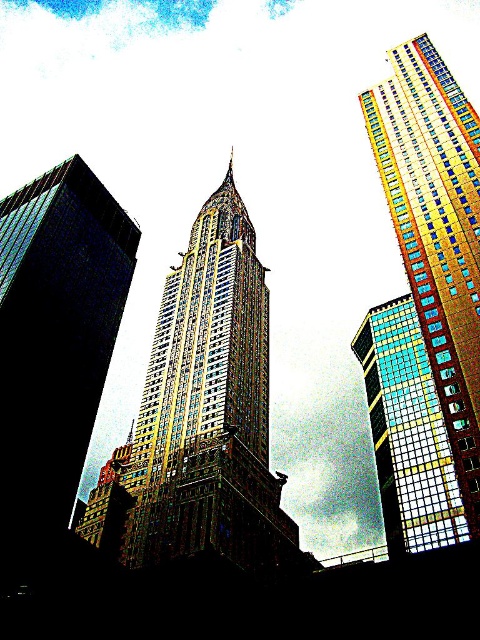
Consider the image. You are an architect analyzing the city skyline. From your vantage point, which of the two buildings, the gold mosaic skyscraper at right or the multicolored glass skyscraper at center, appears higher in the sky?

The gold mosaic skyscraper at right is above the multicolored glass skyscraper at center, so it appears higher in the sky.

You are an architect analyzing the city skyline. You observe the gold glass skyscraper at center and the multicolored glass skyscraper at center. Which one has a greater height?

The gold glass skyscraper at center is taller than the multicolored glass skyscraper at center.